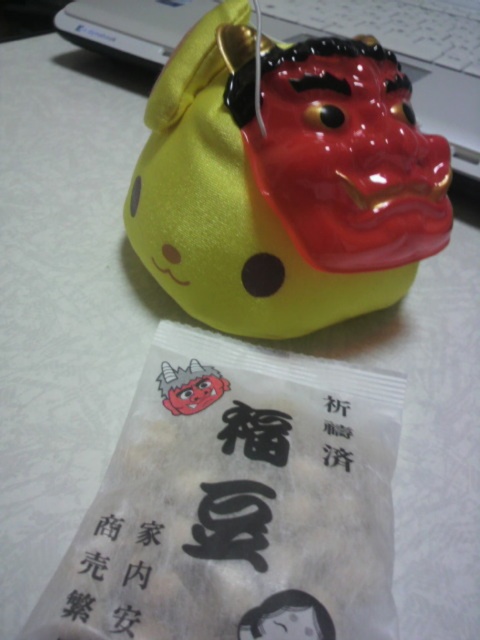
Question: Among these points, which one is nearest to the camera?

Choices:
 (A) (317, 264)
 (B) (99, 573)

Answer: (B)

Question: Which point is farther to the camera?

Choices:
 (A) (85, 525)
 (B) (328, 246)

Answer: (B)

Question: Does shiny yellow plush toy at center have a smaller size compared to black paper at upper center?

Choices:
 (A) yes
 (B) no

Answer: (B)

Question: Is shiny yellow plush toy at center positioned before black paper at upper center?

Choices:
 (A) no
 (B) yes

Answer: (A)

Question: Observing the image, what is the correct spatial positioning of shiny yellow plush toy at center in reference to black paper at upper center?

Choices:
 (A) right
 (B) left

Answer: (A)

Question: Which point appears farthest from the camera in this image?

Choices:
 (A) (133, 545)
 (B) (360, 214)

Answer: (B)